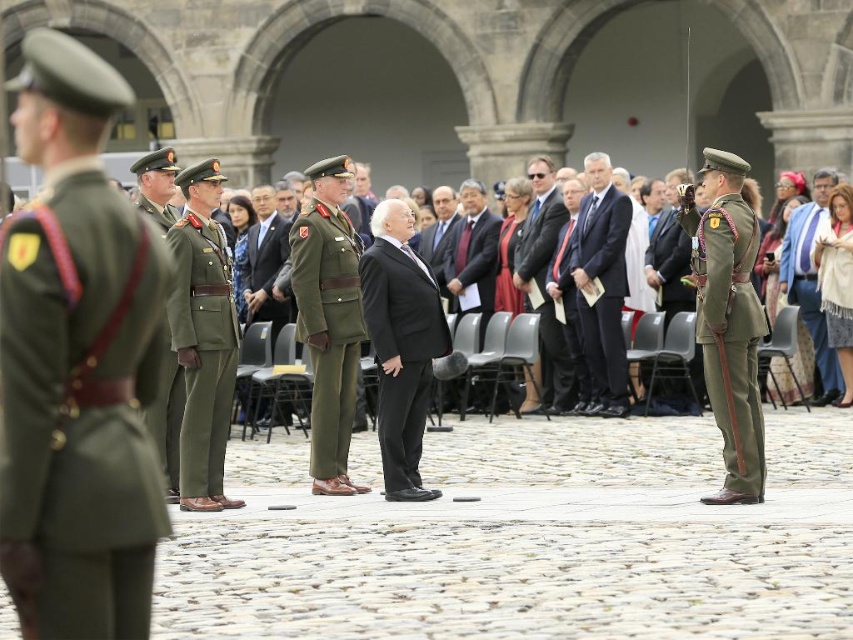
Which is below, matte black suit at center or black smooth suit at center?

Positioned lower is black smooth suit at center.

Looking at this image, can you confirm if matte black suit at center is smaller than black smooth suit at center?

Incorrect, matte black suit at center is not smaller in size than black smooth suit at center.

Locate an element on the screen. Image resolution: width=853 pixels, height=640 pixels. matte black suit at center is located at coordinates click(543, 282).

Who is higher up, dark blue suit at center or black smooth suit at center?

Positioned higher is dark blue suit at center.

Who is positioned more to the left, dark blue suit at center or black smooth suit at center?

black smooth suit at center

This screenshot has width=853, height=640. Describe the element at coordinates (602, 284) in the screenshot. I see `dark blue suit at center` at that location.

At what (x,y) coordinates should I click in order to perform the action: click on dark blue suit at center. Please return your answer as a coordinate pair (x, y). This screenshot has height=640, width=853. Looking at the image, I should click on (602, 284).

Is matte green uniform at right bigger than green matte uniform at center?

Yes.

Between matte green uniform at right and green matte uniform at center, which one appears on the right side from the viewer's perspective?

From the viewer's perspective, matte green uniform at right appears more on the right side.

Does point (758, 499) come closer to viewer compared to point (289, 264)?

Yes, point (758, 499) is in front of point (289, 264).

Where is `matte green uniform at right`? The height and width of the screenshot is (640, 853). matte green uniform at right is located at coordinates (730, 337).